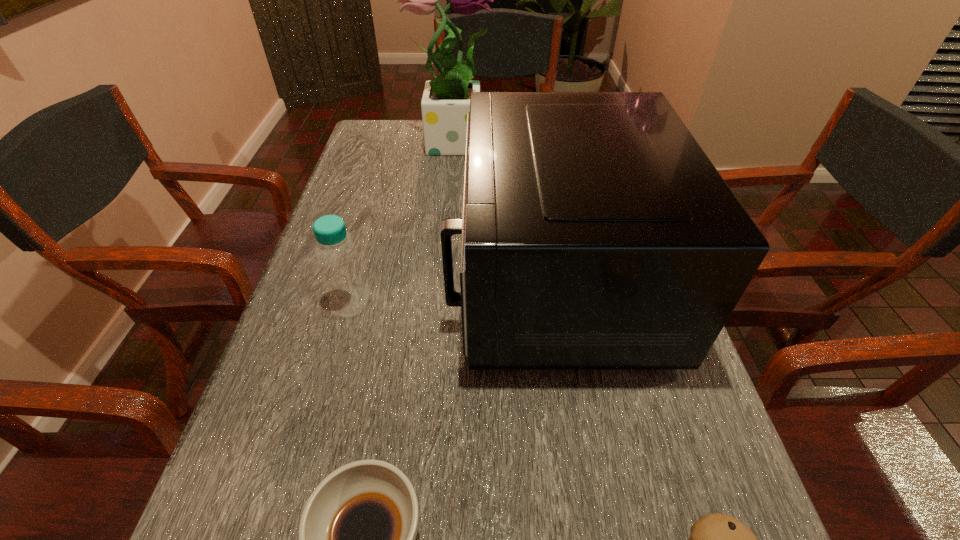
Find the location of a particular element. The image size is (960, 540). the farthest object is located at coordinates (445, 103).

Locate an element on the screen. This screenshot has height=540, width=960. flower arrangement is located at coordinates (445, 103).

Image resolution: width=960 pixels, height=540 pixels. What are the coordinates of `the fourth shortest object` in the screenshot? It's located at (596, 233).

Identify the location of the third shortest object. The image size is (960, 540). pos(337,256).

You are a GUI agent. You are given a task and a screenshot of the screen. Output one action in this format:
    pyautogui.click(x=<x>, y=<y>)
    Task: Click on the leftmost object
    
    Given the screenshot: What is the action you would take?
    pyautogui.click(x=337, y=256)

Where is `free space located on the front-facing side of the tallest object`? free space located on the front-facing side of the tallest object is located at coordinates (540, 140).

What are the coordinates of `free space located 0.120m on the front-facing side of the microwave_oven` in the screenshot? It's located at (x=396, y=278).

Identify the location of vacant space located 0.060m on the front-facing side of the microwave_oven. The image size is (960, 540). (423, 278).

You are a GUI agent. You are given a task and a screenshot of the screen. Output one action in this format:
    pyautogui.click(x=<x>, y=<y>)
    Task: Click on the free space located on the front-facing side of the microwave_oven
    This screenshot has width=960, height=540.
    Given the screenshot: What is the action you would take?
    pyautogui.click(x=396, y=278)

Image resolution: width=960 pixels, height=540 pixels. Find the location of `free space located 0.110m on the back of the bottle`. free space located 0.110m on the back of the bottle is located at coordinates (366, 250).